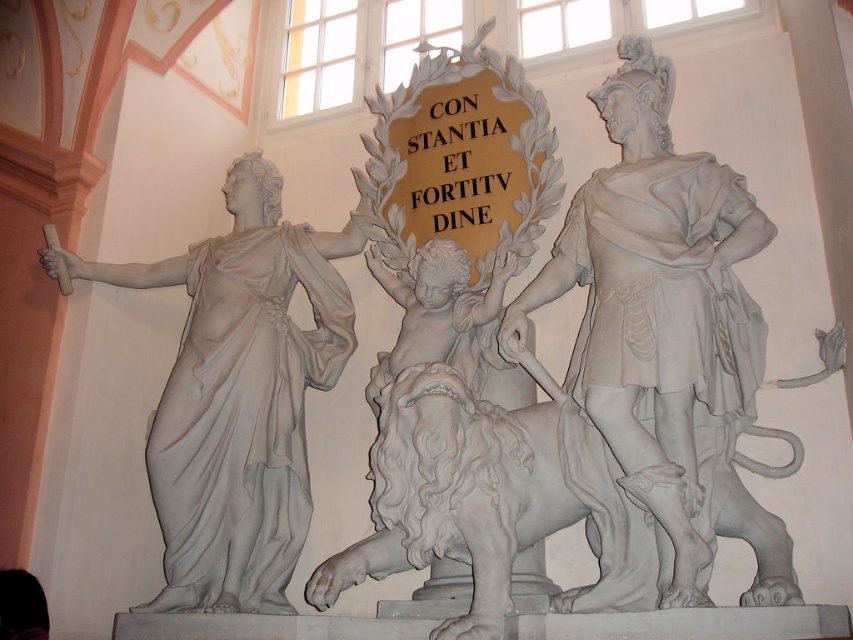
Which is more to the right, white marble statue at right or white marble statue at left?

Positioned to the right is white marble statue at right.

What do you see at coordinates (657, 310) in the screenshot? I see `white marble statue at right` at bounding box center [657, 310].

Does point (598, 262) come behind point (236, 404)?

No, (598, 262) is in front of (236, 404).

Identify the location of white marble statue at right. (657, 310).